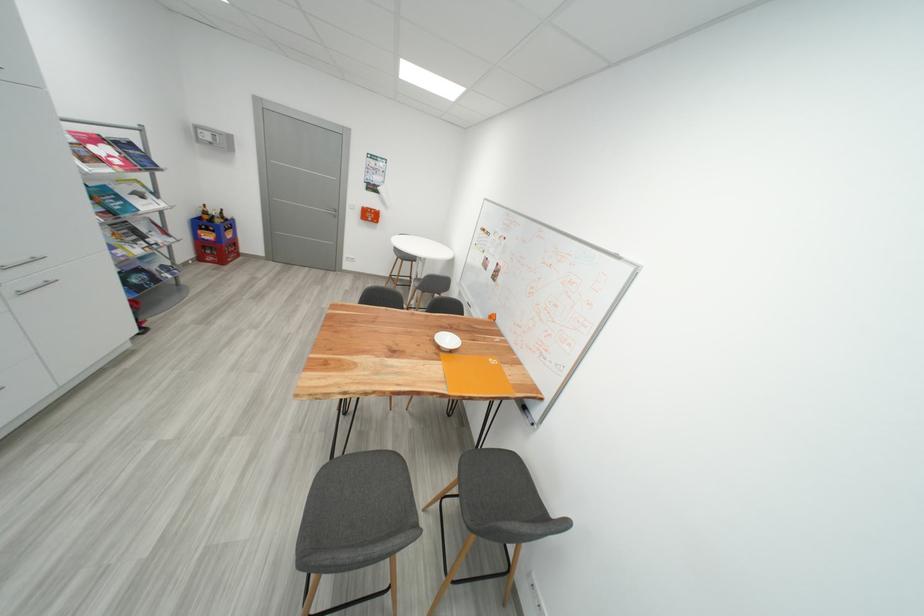
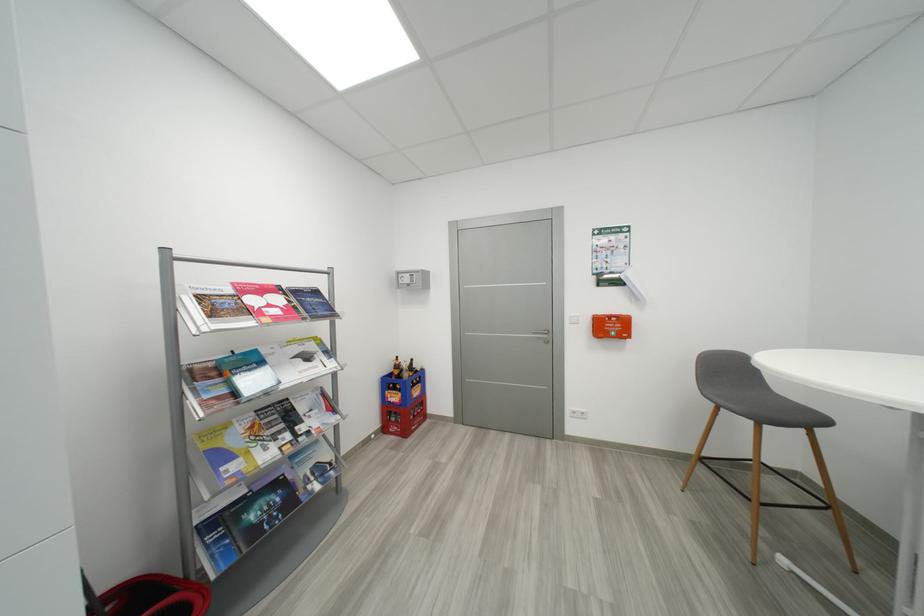
Question: I am providing you with two images of the same scene from different viewpoints. Which of the following objects are not visible in image2?

Choices:
 (A) red bottle crate
 (B) chair sitting surface
 (C) red first aid kit
 (D) none of these

Answer: (D)